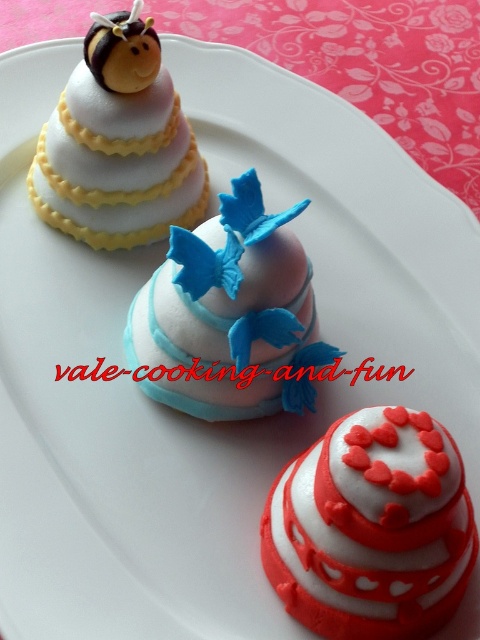
You are a chef arranging a display of cakes on a white oval plate. You have a matte pink fondant cake at center. Where should you place it to ensure it is centered on the plate?

The matte pink fondant cake at center should be placed at point (230,310) to ensure it is centered on the plate.

You are a baker arranging cakes on a display table. You have the matte pink fondant cake at center and the matte white fondant cake at upper left. Which cake takes up more space on the table?

The matte white fondant cake at upper left occupies more space than the matte pink fondant cake at center.